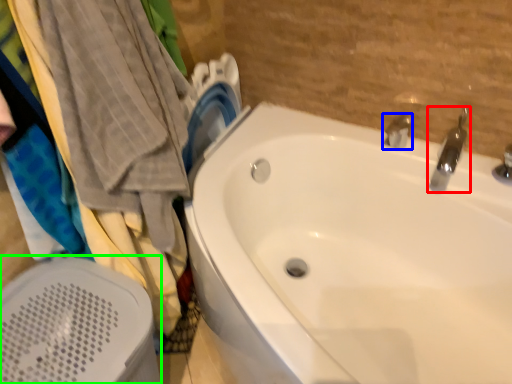
Question: Estimate the real-world distances between objects in this image. Which object is farther from tap (highlighted by a red box), tap (highlighted by a blue box) or bath heater (highlighted by a green box)?

Choices:
 (A) tap
 (B) bath heater

Answer: (B)